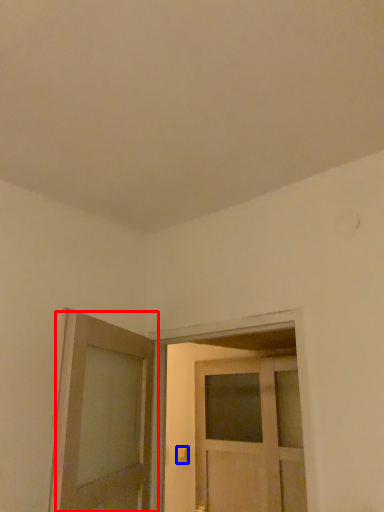
Question: Which point is further to the camera, door (highlighted by a red box) or door handle (highlighted by a blue box)?

Choices:
 (A) door
 (B) door handle

Answer: (B)